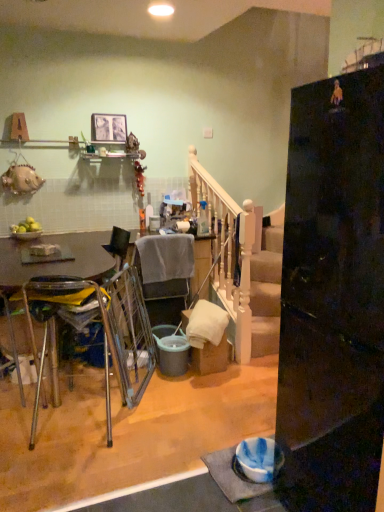
Question: Is matte gray bucket at center directly adjacent to white wooden rail at center?

Choices:
 (A) yes
 (B) no

Answer: (B)

Question: Can you confirm if matte gray bucket at center is bigger than white wooden rail at center?

Choices:
 (A) no
 (B) yes

Answer: (A)

Question: Does matte gray bucket at center contain white wooden rail at center?

Choices:
 (A) no
 (B) yes

Answer: (A)

Question: Considering the relative sizes of matte gray bucket at center and white wooden rail at center in the image provided, is matte gray bucket at center smaller than white wooden rail at center?

Choices:
 (A) yes
 (B) no

Answer: (A)

Question: Could you tell me if matte gray bucket at center is turned towards white wooden rail at center?

Choices:
 (A) no
 (B) yes

Answer: (A)

Question: In the image, is matte glass picture frame at upper center on the left side or the right side of gray fabric chair at center, which is the first chair from right to left?

Choices:
 (A) right
 (B) left

Answer: (B)

Question: Looking at their shapes, would you say matte glass picture frame at upper center is wider or thinner than gray fabric chair at center, which is the second chair from front to back?

Choices:
 (A) thin
 (B) wide

Answer: (A)

Question: From their relative heights in the image, would you say matte glass picture frame at upper center is taller or shorter than gray fabric chair at center, the 1th chair viewed from the back?

Choices:
 (A) short
 (B) tall

Answer: (A)

Question: Does point (125, 123) appear closer or farther from the camera than point (147, 248)?

Choices:
 (A) farther
 (B) closer

Answer: (A)

Question: Is metallic silver swivel chair at center bigger or smaller than glossy black refrigerator at right?

Choices:
 (A) small
 (B) big

Answer: (A)

Question: From the image's perspective, is metallic silver swivel chair at center located above or below glossy black refrigerator at right?

Choices:
 (A) below
 (B) above

Answer: (A)

Question: Relative to glossy black refrigerator at right, is metallic silver swivel chair at center in front or behind?

Choices:
 (A) front
 (B) behind

Answer: (B)

Question: In terms of width, does metallic silver swivel chair at center look wider or thinner when compared to glossy black refrigerator at right?

Choices:
 (A) wide
 (B) thin

Answer: (B)

Question: Considering the positions of point (205, 204) and point (236, 351), is point (205, 204) closer or farther from the camera than point (236, 351)?

Choices:
 (A) closer
 (B) farther

Answer: (B)

Question: From a real-world perspective, is translucent glass bottle at upper center above or below white wooden rail at center?

Choices:
 (A) above
 (B) below

Answer: (A)